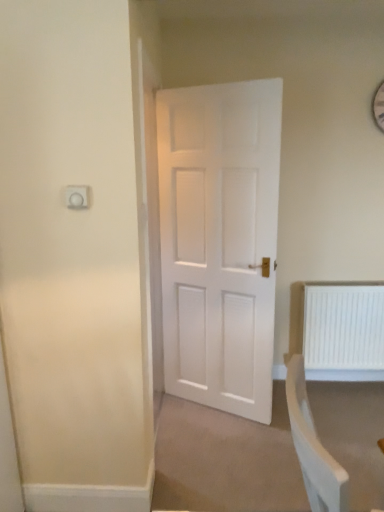
Question: Visually, is white plastic socket at upper left positioned to the left or to the right of white plastic radiator at lower right?

Choices:
 (A) left
 (B) right

Answer: (A)

Question: Considering the positions of white plastic socket at upper left and white plastic radiator at lower right in the image, is white plastic socket at upper left wider or thinner than white plastic radiator at lower right?

Choices:
 (A) thin
 (B) wide

Answer: (A)

Question: Is white plastic socket at upper left in front of or behind white plastic radiator at lower right in the image?

Choices:
 (A) behind
 (B) front

Answer: (B)

Question: From the image's perspective, is white plastic radiator at lower right above or below white plastic socket at upper left?

Choices:
 (A) above
 (B) below

Answer: (B)

Question: Considering the positions of white plastic radiator at lower right and white plastic socket at upper left in the image, is white plastic radiator at lower right bigger or smaller than white plastic socket at upper left?

Choices:
 (A) big
 (B) small

Answer: (A)

Question: Considering their positions, is white plastic radiator at lower right located in front of or behind white plastic socket at upper left?

Choices:
 (A) behind
 (B) front

Answer: (A)

Question: Would you say white plastic radiator at lower right is to the left or to the right of white plastic socket at upper left in the picture?

Choices:
 (A) right
 (B) left

Answer: (A)